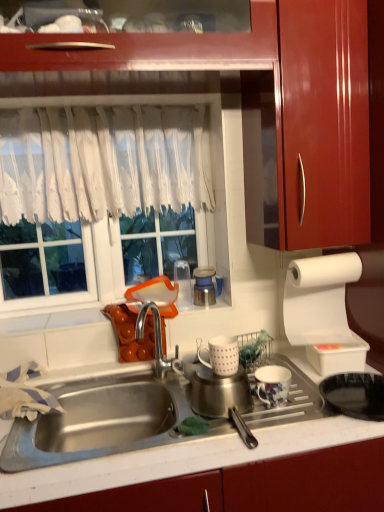
Question: Should I look upward or downward to see metallic blue thermos at center, the first appliance when ordered from left to right?

Choices:
 (A) up
 (B) down

Answer: (B)

Question: Is white lace curtain at upper center oriented away from white matte mug at center, the 2th tableware in the right-to-left sequence?

Choices:
 (A) no
 (B) yes

Answer: (A)

Question: Considering the relative sizes of white lace curtain at upper center and white matte mug at center, placed as the first tableware when sorted from top to bottom, in the image provided, is white lace curtain at upper center thinner than white matte mug at center, placed as the first tableware when sorted from top to bottom,?

Choices:
 (A) yes
 (B) no

Answer: (A)

Question: Is white lace curtain at upper center closer to camera compared to white matte mug at center, placed as the first tableware when sorted from top to bottom?

Choices:
 (A) yes
 (B) no

Answer: (B)

Question: From the image's perspective, is white lace curtain at upper center below white matte mug at center, the 2th tableware in the right-to-left sequence?

Choices:
 (A) no
 (B) yes

Answer: (A)

Question: Is white lace curtain at upper center oriented towards white matte mug at center, the first tableware from the left?

Choices:
 (A) no
 (B) yes

Answer: (B)

Question: Is white matte mug at center, which is the second tableware from bottom to top, a part of white lace curtain at upper center?

Choices:
 (A) no
 (B) yes

Answer: (A)

Question: Is white matte mug at center, the first tableware from the left, at the back of glossy wood cabinet at upper right?

Choices:
 (A) no
 (B) yes

Answer: (A)

Question: Does glossy wood cabinet at upper right have a smaller size compared to white matte mug at center, placed as the first tableware when sorted from top to bottom?

Choices:
 (A) yes
 (B) no

Answer: (B)

Question: Considering the relative sizes of glossy wood cabinet at upper right and white matte mug at center, the first tableware from the left, in the image provided, is glossy wood cabinet at upper right taller than white matte mug at center, the first tableware from the left,?

Choices:
 (A) no
 (B) yes

Answer: (B)

Question: From the image's perspective, is glossy wood cabinet at upper right located beneath white matte mug at center, the first tableware from the left?

Choices:
 (A) yes
 (B) no

Answer: (B)

Question: Is glossy wood cabinet at upper right positioned far away from white matte mug at center, placed as the first tableware when sorted from top to bottom?

Choices:
 (A) yes
 (B) no

Answer: (B)

Question: Considering the relative sizes of glossy wood cabinet at upper right and white matte mug at center, which is the second tableware from bottom to top, in the image provided, is glossy wood cabinet at upper right bigger than white matte mug at center, which is the second tableware from bottom to top,?

Choices:
 (A) yes
 (B) no

Answer: (A)

Question: Does glossy wood cabinet at upper right lie behind white lace curtain at upper center?

Choices:
 (A) no
 (B) yes

Answer: (A)